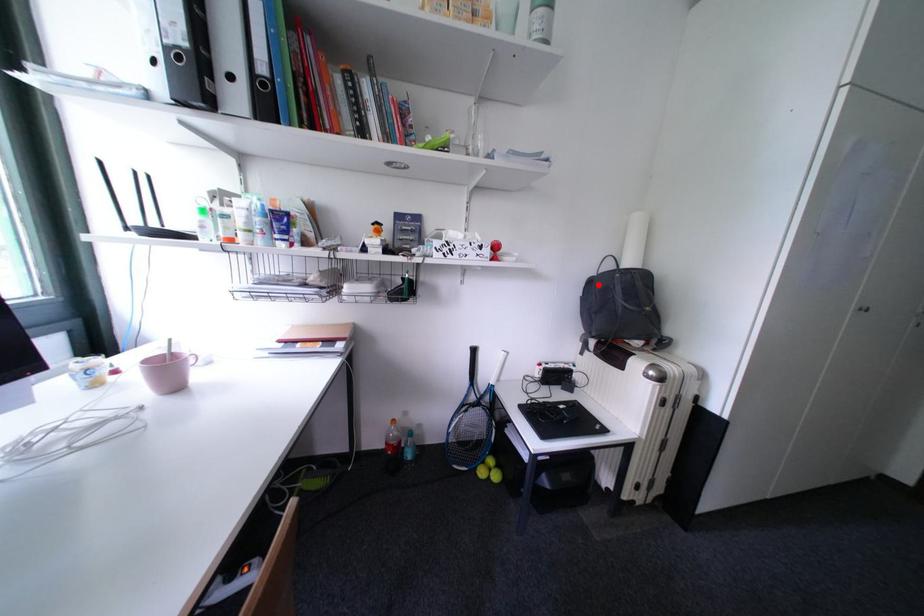
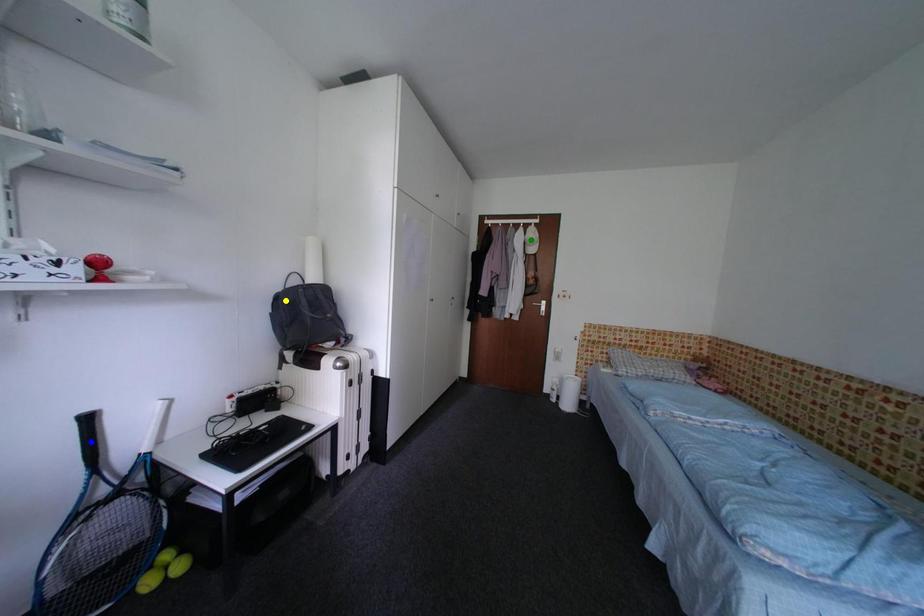
Question: I am providing you with two images of the same scene from different viewpoints. A red point is marked on the first image. You are given multiple points on the second image. Which mark in image 2 goes with the point in image 1?

Choices:
 (A) green point
 (B) blue point
 (C) yellow point

Answer: (C)